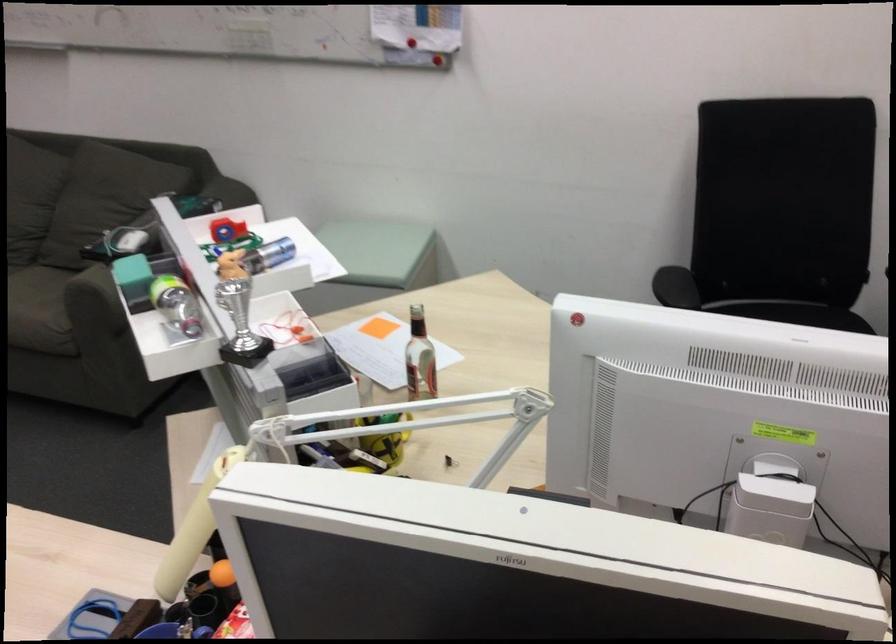
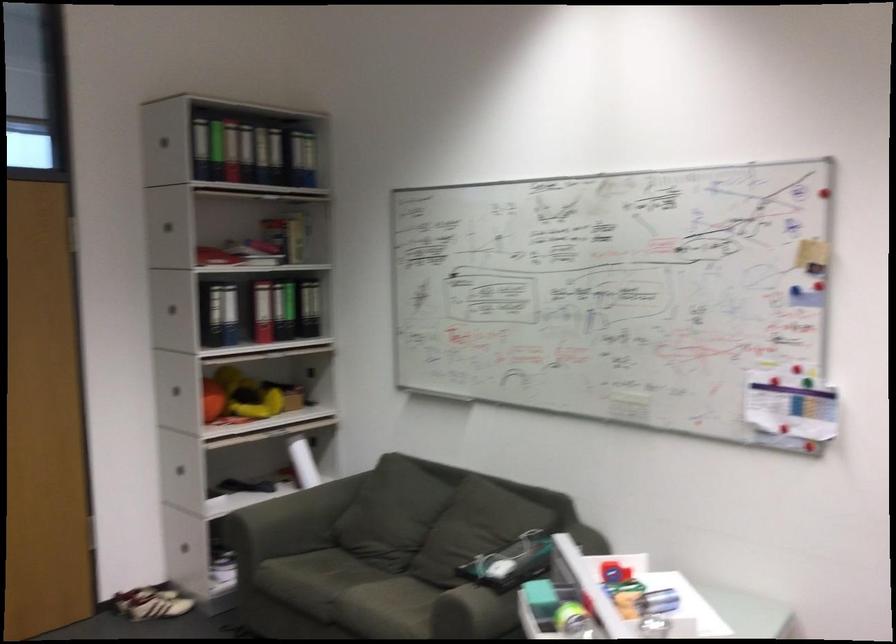
From the picture: The images are taken continuously from a first-person perspective. In which direction is your viewpoint rotating?

The rotation direction of the camera is left-up.